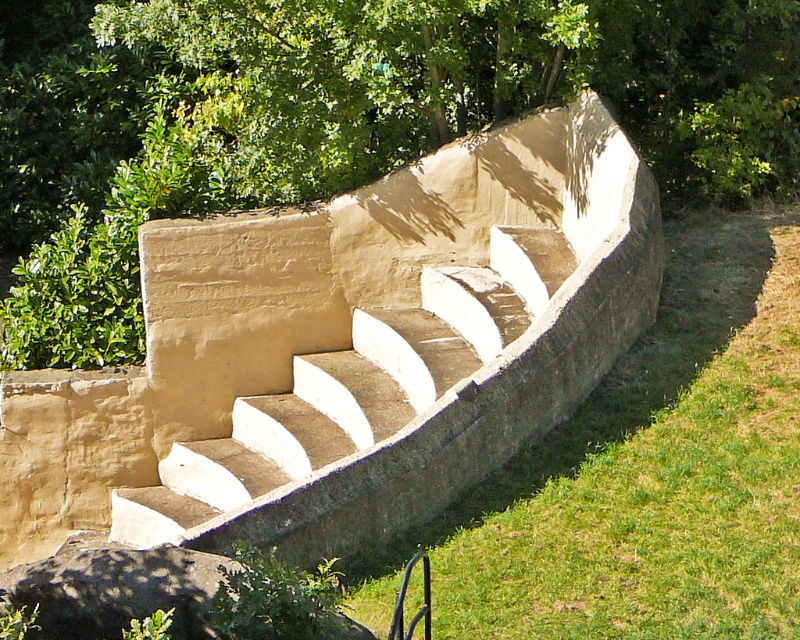
You are planning to take a photograph of the beige concrete stairs at center while standing near the green leafy tree at upper center. Since the tree is larger than the stairs, will the tree block the view of the stairs in your photo if you aim directly towards them?

The green leafy tree at upper center is larger than the beige concrete stairs at center, so if you aim directly towards the stairs from near the tree, the tree might block the view of the stairs depending on their exact positions and angles.